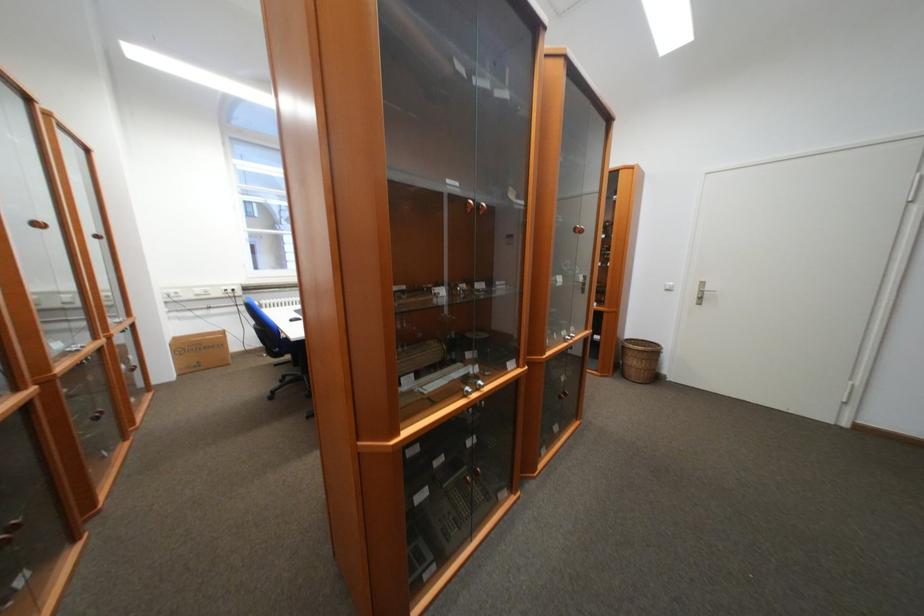
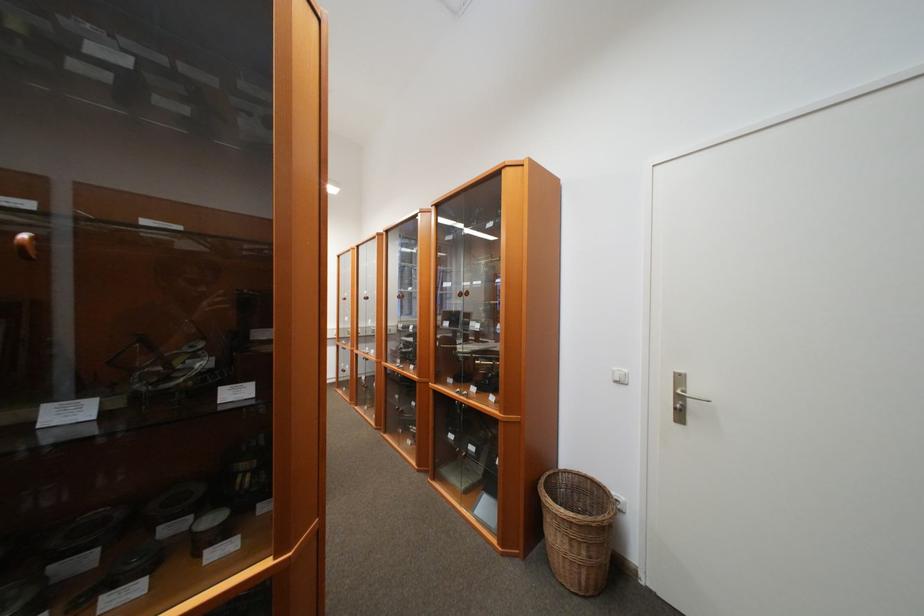
In the second image, find the point that corresponds to pixel 640 347 in the first image.

(560, 501)